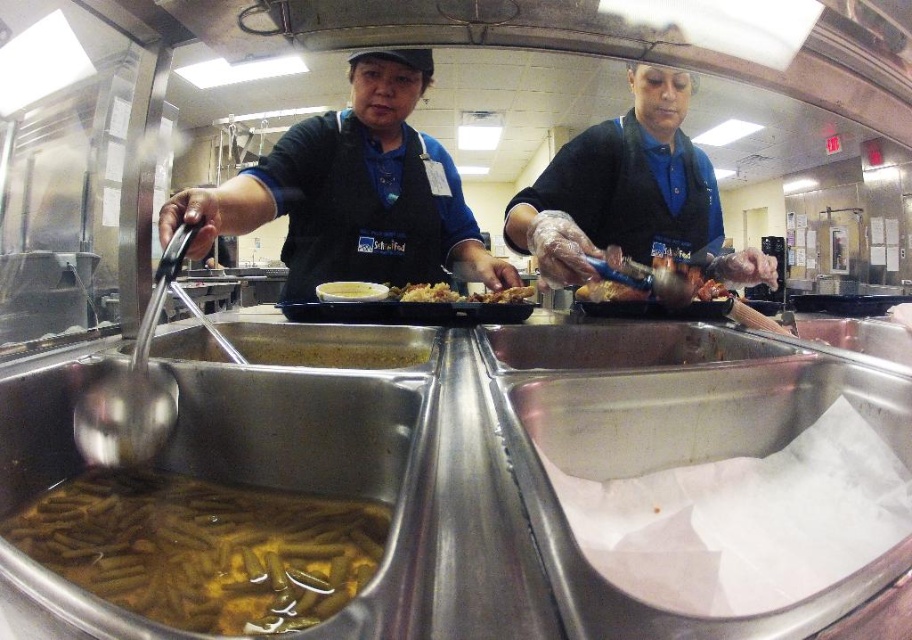
Question: Is the position of blue uniform at center more distant than that of brown matte rice at center?

Choices:
 (A) yes
 (B) no

Answer: (B)

Question: Which of the following is the farthest from the observer?

Choices:
 (A) (451, 292)
 (B) (512, 296)
 (C) (620, 268)
 (D) (363, 292)

Answer: (A)

Question: Can you confirm if blue fabric apron at center is wider than brown crispy chicken at center?

Choices:
 (A) no
 (B) yes

Answer: (B)

Question: Which point is closer to the camera taking this photo?

Choices:
 (A) (348, 138)
 (B) (137, 605)
 (C) (346, 294)
 (D) (422, 289)

Answer: (B)

Question: Which of these objects is positioned farthest from the golden crispy chicken at center?

Choices:
 (A) brown matte rice at center
 (B) blue uniform at center
 (C) blue fabric apron at center

Answer: (B)

Question: Can you confirm if shiny brown meat at center is positioned to the left of brown matte rice at center?

Choices:
 (A) yes
 (B) no

Answer: (B)